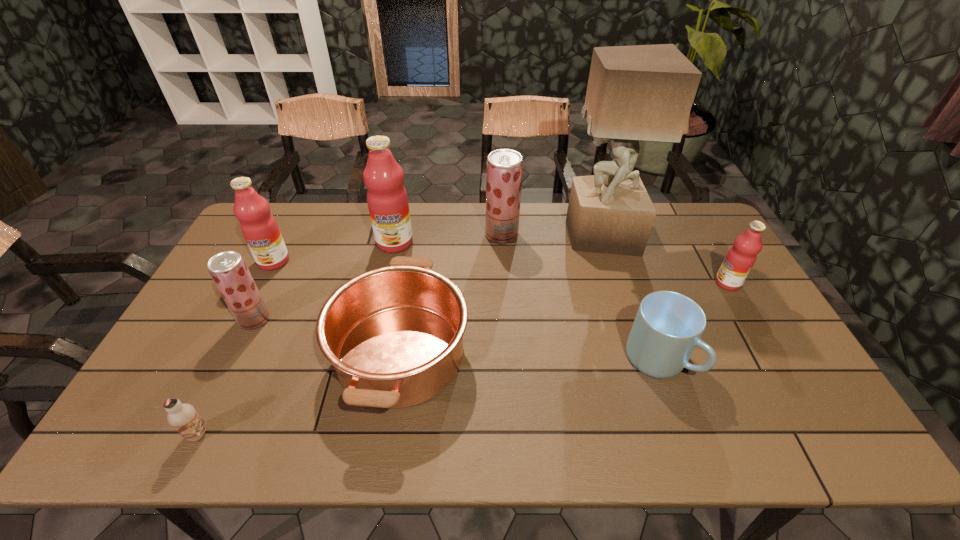
Identify the location of free spot between the chocolate milk and the second smallest pink fruit juice. This screenshot has width=960, height=540. (236, 347).

The width and height of the screenshot is (960, 540). What are the coordinates of `free space that is in between the right strawberry fruit juice and the tallest fruit juice` in the screenshot? It's located at (448, 239).

Locate an element on the screen. vacant space that's between the saucepan and the chocolate milk is located at coordinates (300, 394).

Where is `free space between the second pink fruit juice from right to left and the leftmost pink fruit juice`? The image size is (960, 540). free space between the second pink fruit juice from right to left and the leftmost pink fruit juice is located at coordinates (334, 252).

Locate which object ranks third in proximity to the saucepan. Please provide its 2D coordinates. Your answer should be formatted as a tuple, i.e. [(x, y)], where the tuple contains the x and y coordinates of a point satisfying the conditions above.

[(504, 167)]

Identify which object is the third closest to the rightmost fruit juice. Please provide its 2D coordinates. Your answer should be formatted as a tuple, i.e. [(x, y)], where the tuple contains the x and y coordinates of a point satisfying the conditions above.

[(504, 167)]

At what (x,y) coordinates should I click in order to perform the action: click on fruit juice that stands as the closest to the fourth object from right to left. Please return your answer as a coordinate pair (x, y). Image resolution: width=960 pixels, height=540 pixels. Looking at the image, I should click on (387, 199).

Locate an element on the screen. The width and height of the screenshot is (960, 540). the third closest fruit juice to the leftmost pink fruit juice is located at coordinates (504, 167).

At what (x,y) coordinates should I click in order to perform the action: click on the closest pink fruit juice to the mug. Please return your answer as a coordinate pair (x, y). Looking at the image, I should click on (741, 257).

Identify which pink fruit juice is located as the nearest to the tallest fruit juice. Please provide its 2D coordinates. Your answer should be formatted as a tuple, i.e. [(x, y)], where the tuple contains the x and y coordinates of a point satisfying the conditions above.

[(259, 227)]